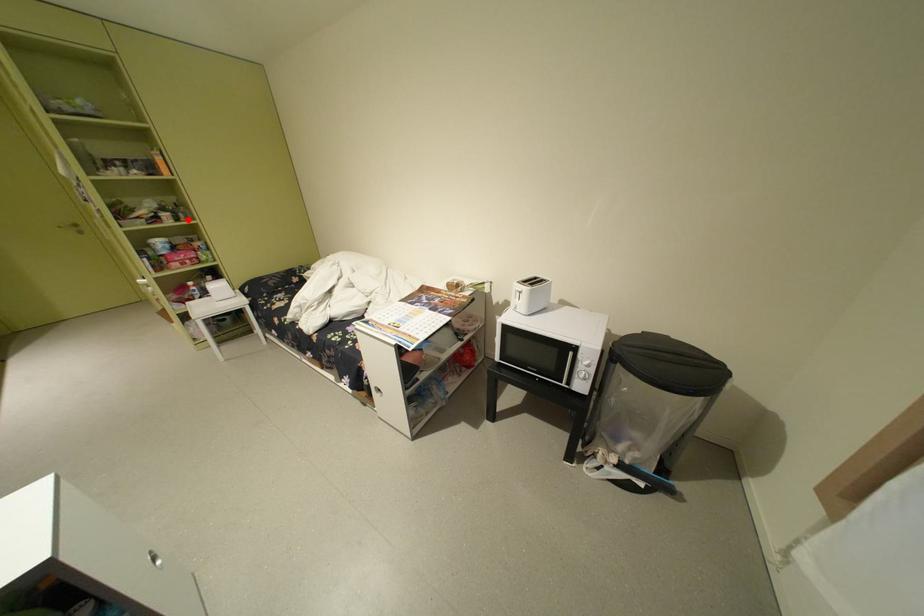
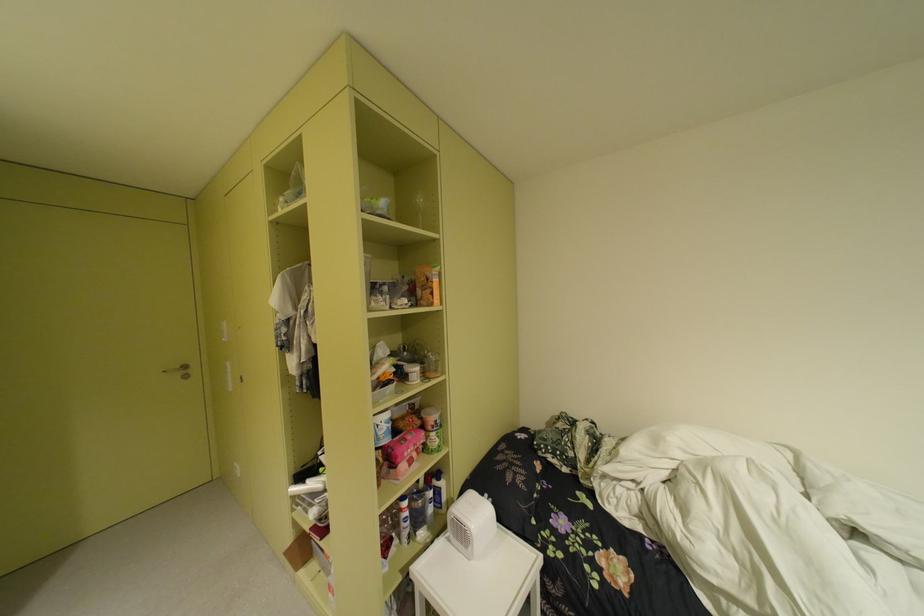
Where in the second image is the point corresponding to the highlighted location from the first image?

(434, 376)